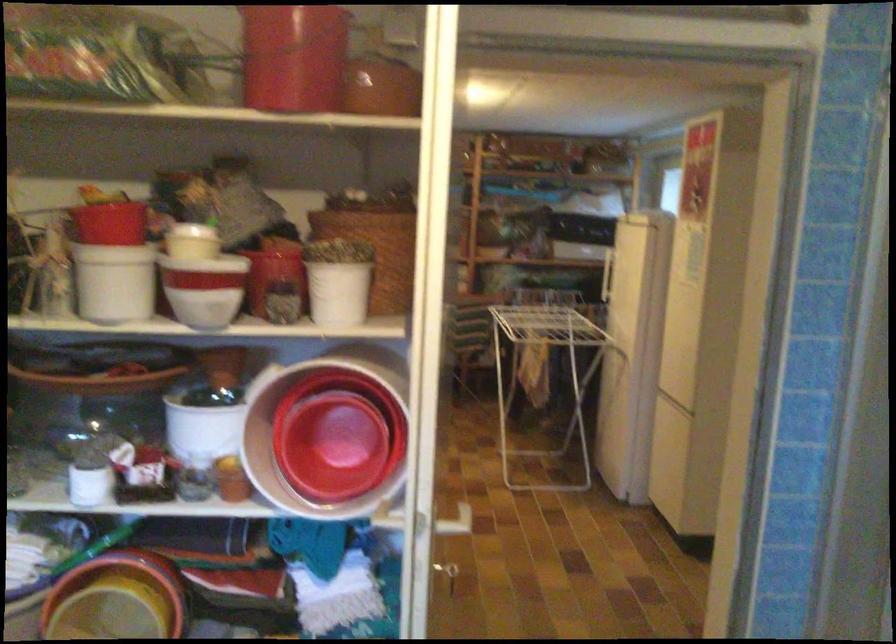
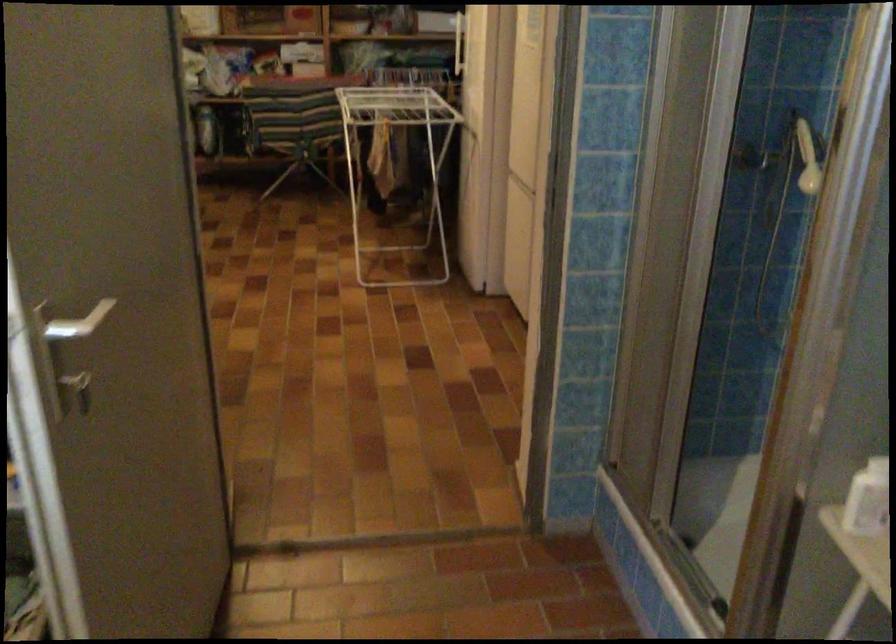
The images are taken continuously from a first-person perspective. In which direction are you moving?

The movement direction of the cameraman is right, forward.